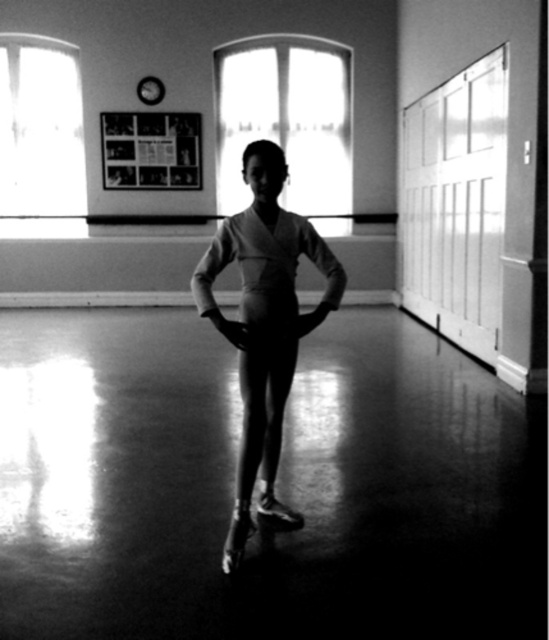
Is matte white leotard at center taller than smooth fabric tights at center?

Yes, matte white leotard at center is taller than smooth fabric tights at center.

Does point (282, 397) come in front of point (244, 352)?

No, (282, 397) is behind (244, 352).

Locate an element on the screen. The height and width of the screenshot is (640, 549). matte white leotard at center is located at coordinates (264, 324).